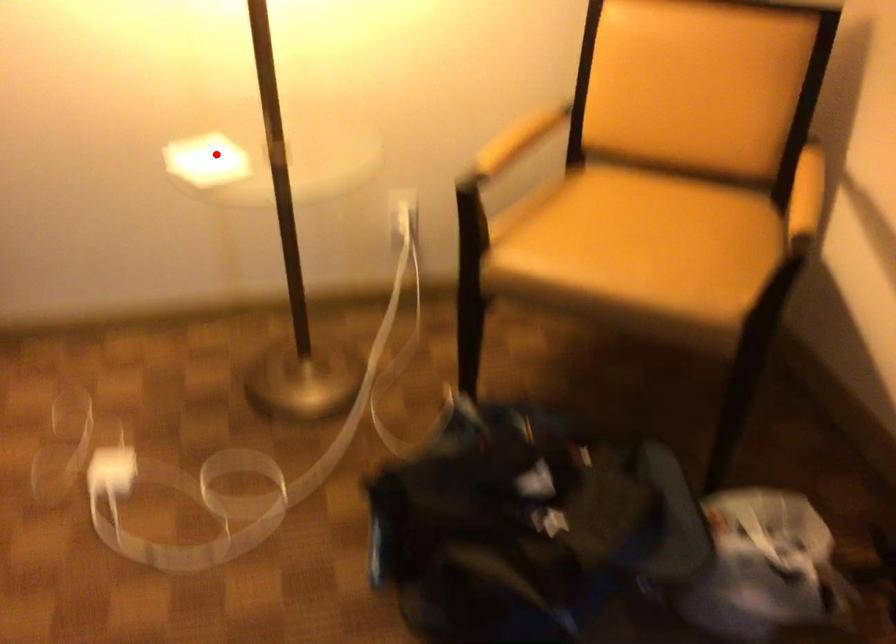
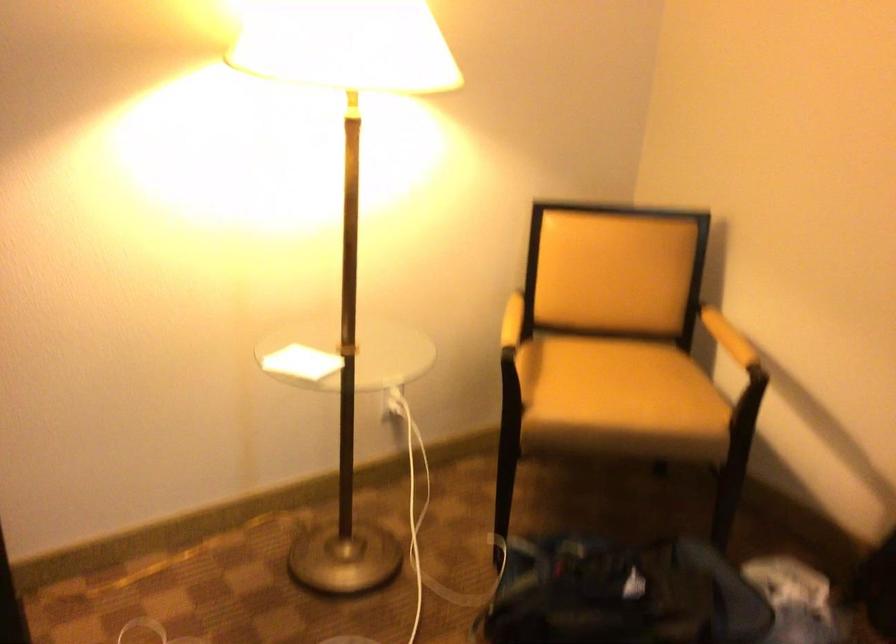
Question: I am providing you with two images of the same scene from different viewpoints. Given a red point in image1, look at the same physical point in image2. Is it:

Choices:
 (A) Closer to the viewpoint
 (B) Farther from the viewpoint

Answer: (B)